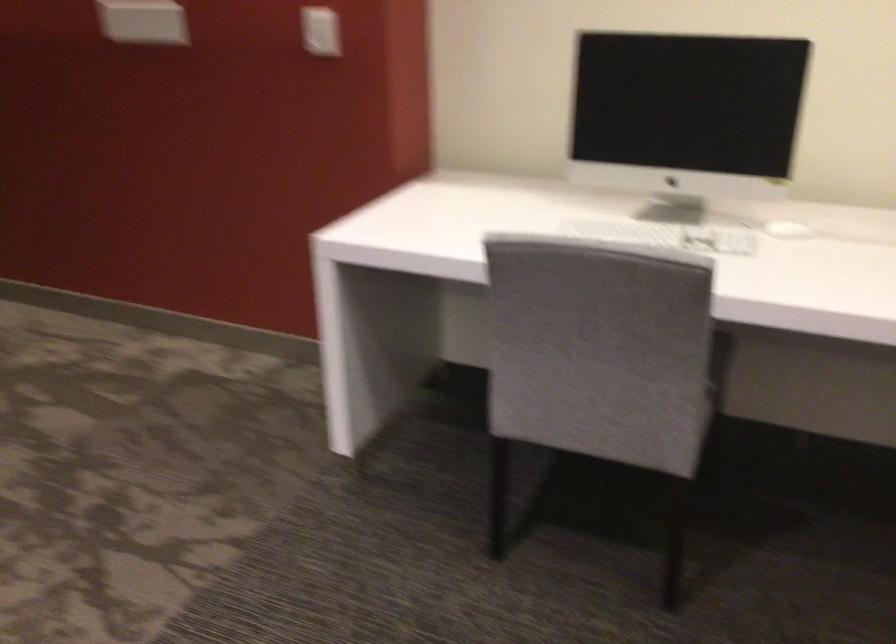
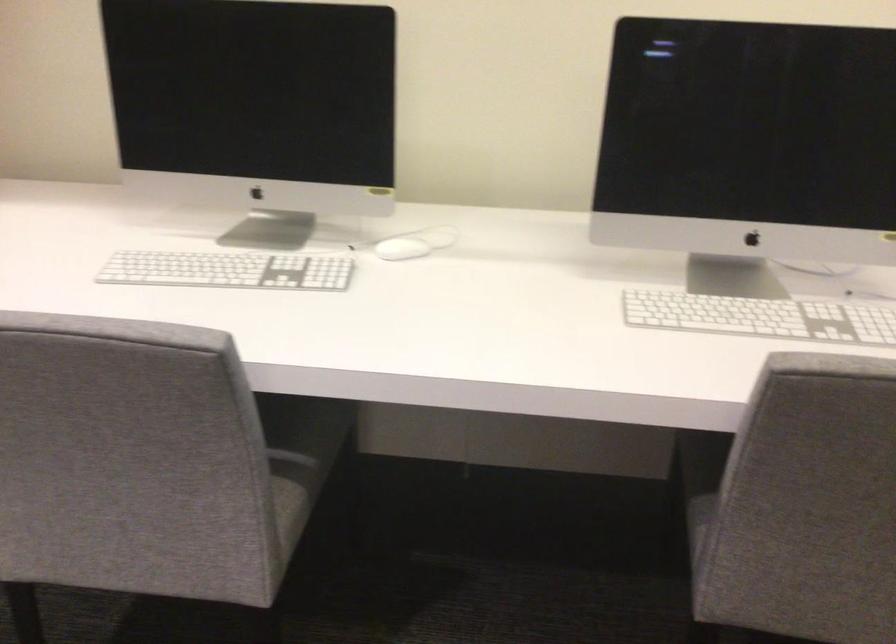
Find the pixel in the second image that matches point 688,373 in the first image.

(291, 456)